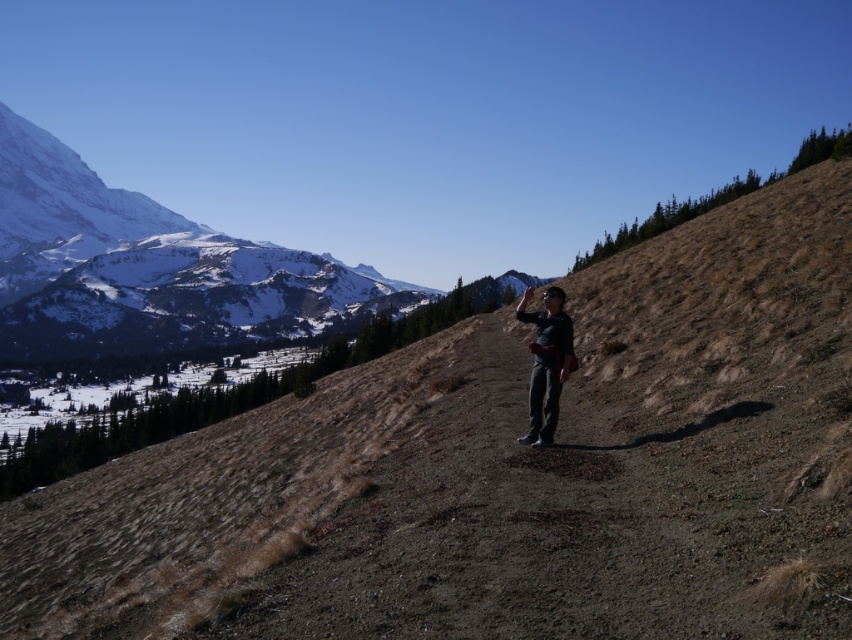
You are a hiker trying to navigate a narrow trail in the mountains. You see two points marked on your map at coordinates point (x=106, y=353) and point (x=551, y=380). Which point should you reach first if you want to follow the trail in the correct direction?

You should reach point (x=106, y=353) first because it is behind point (x=551, y=380), meaning the trail progresses from the latter to the former when moving forward.

You are a hiker planning to take a photo of the snowy granite mountain at upper left and the dark gray pants at center. Which object should you focus on first if you want both to be in sharp focus?

The snowy granite mountain at upper left is bigger than the dark gray pants at center, so you should focus on the snowy granite mountain at upper left first to ensure both are in focus.